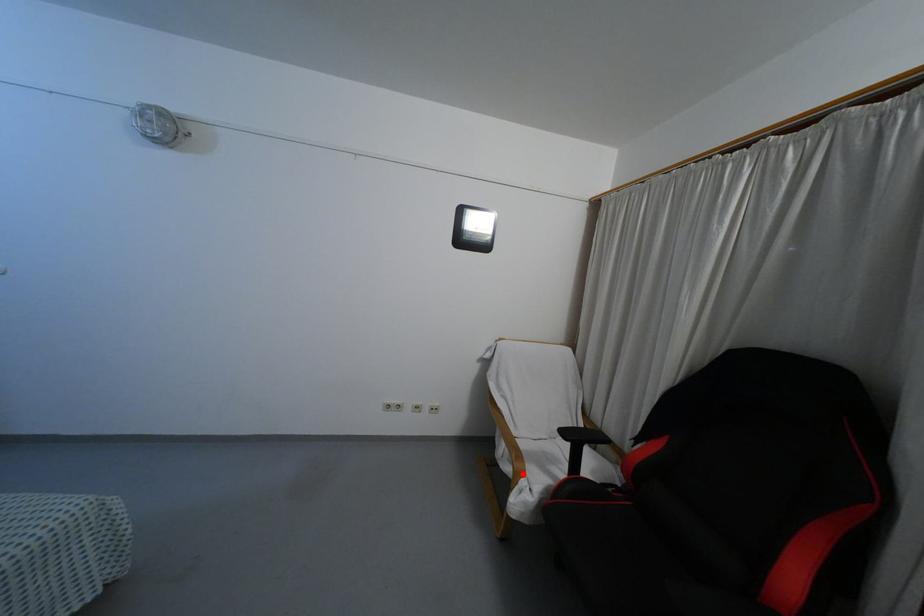
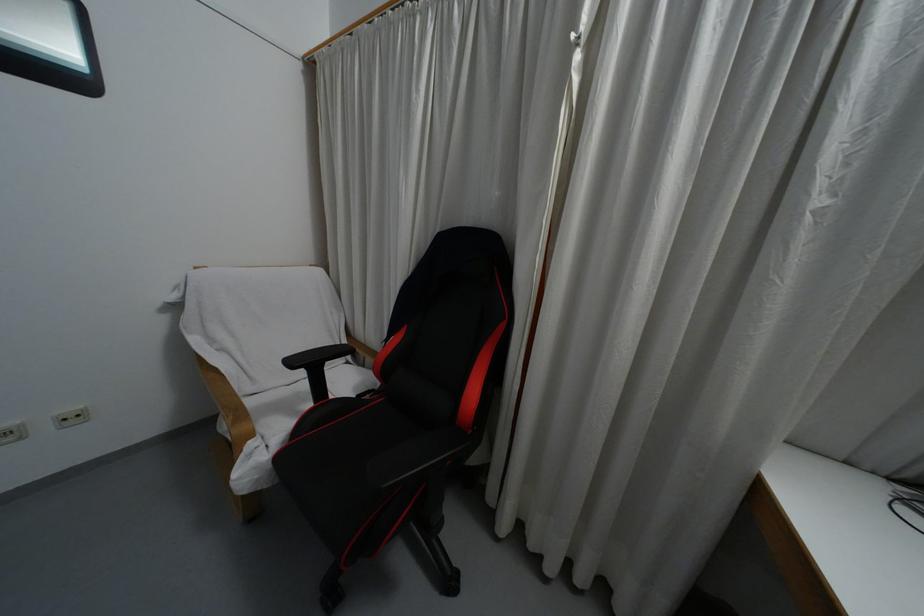
Question: I am providing you with two images of the same scene from different viewpoints. A red point is marked on the first image. Can you still see the location of the red point in image 2?

Choices:
 (A) Yes
 (B) No

Answer: (A)